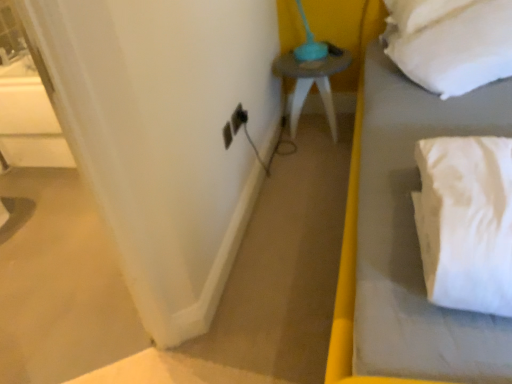
Question: Considering their positions, is white soft pillow at upper right located in front of or behind white soft bed at right?

Choices:
 (A) front
 (B) behind

Answer: (B)

Question: Would you say white soft pillow at upper right is inside or outside white soft bed at right?

Choices:
 (A) inside
 (B) outside

Answer: (A)

Question: Which is farther from the matte gray side table at center?

Choices:
 (A) white soft pillow at upper right
 (B) black plastic electric outlet at lower center
 (C) white soft bed at right
 (D) white fabric curtain at left

Answer: (D)

Question: Which object is the closest to the black plastic electric outlet at lower center?

Choices:
 (A) white soft pillow at upper right
 (B) matte gray side table at center
 (C) white fabric curtain at left
 (D) white soft bed at right

Answer: (C)